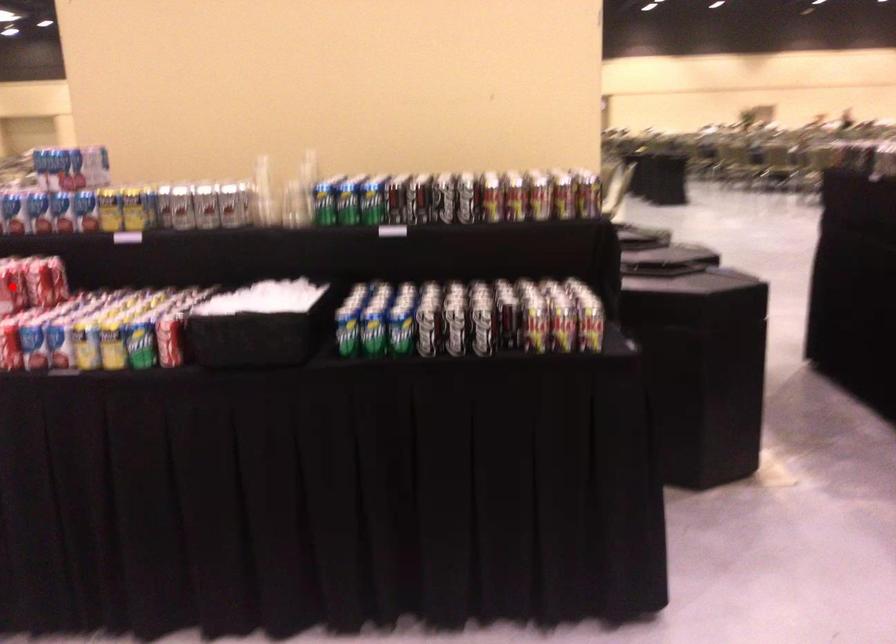
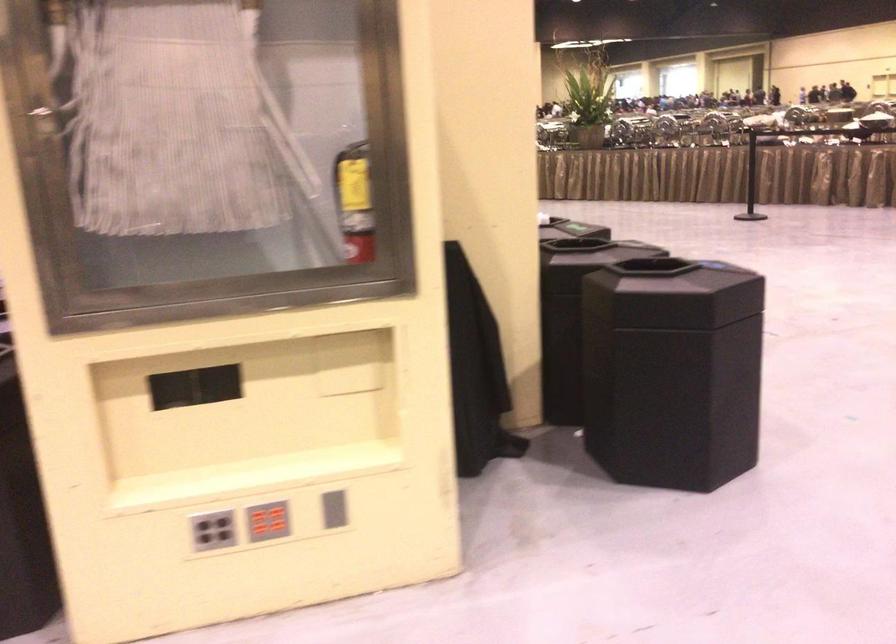
Question: I am providing you with two images of the same scene from different viewpoints. A red point is marked on the first image. Is the red point's position out of view in image 2?

Choices:
 (A) Yes
 (B) No

Answer: (A)